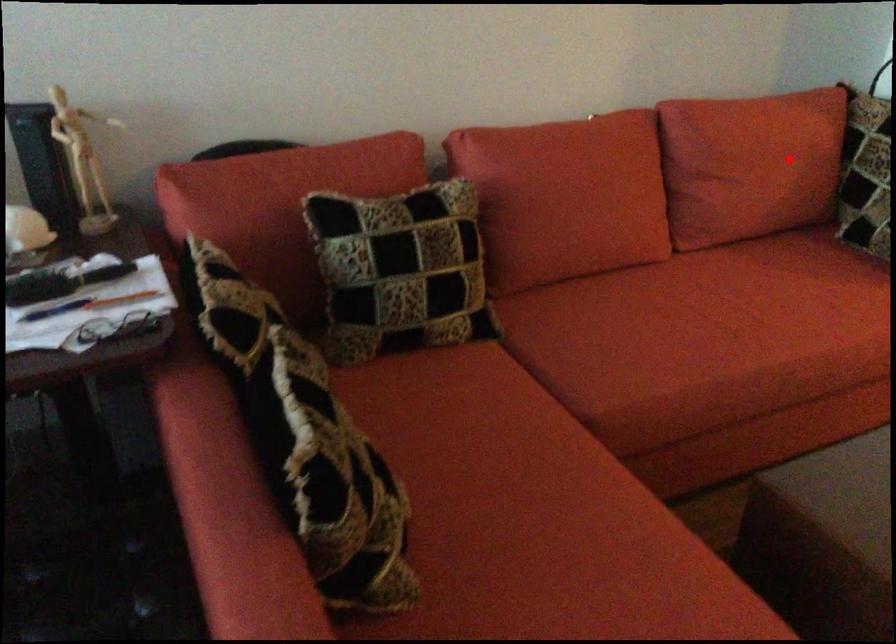
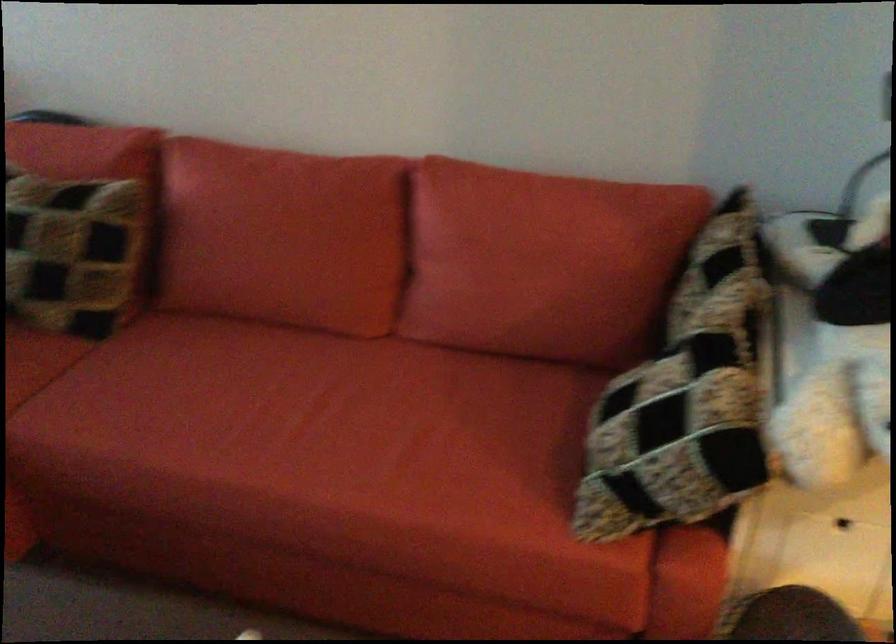
Question: I am providing you with two images of the same scene from different viewpoints. Image1 has a red point marked. In image2, the corresponding 3D location appears at what relative position? Reply with the corresponding letter.

Choices:
 (A) Closer
 (B) Farther

Answer: (A)